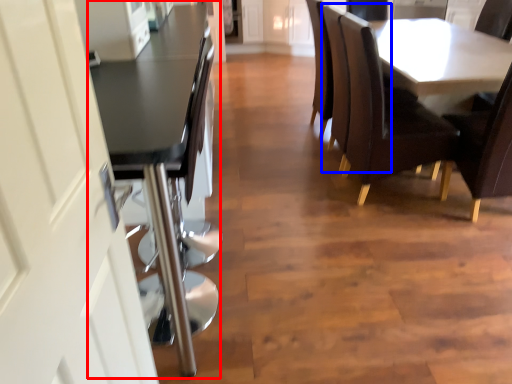
Question: Which point is closer to the camera, table (highlighted by a red box) or armchair (highlighted by a blue box)?

Choices:
 (A) table
 (B) armchair

Answer: (A)